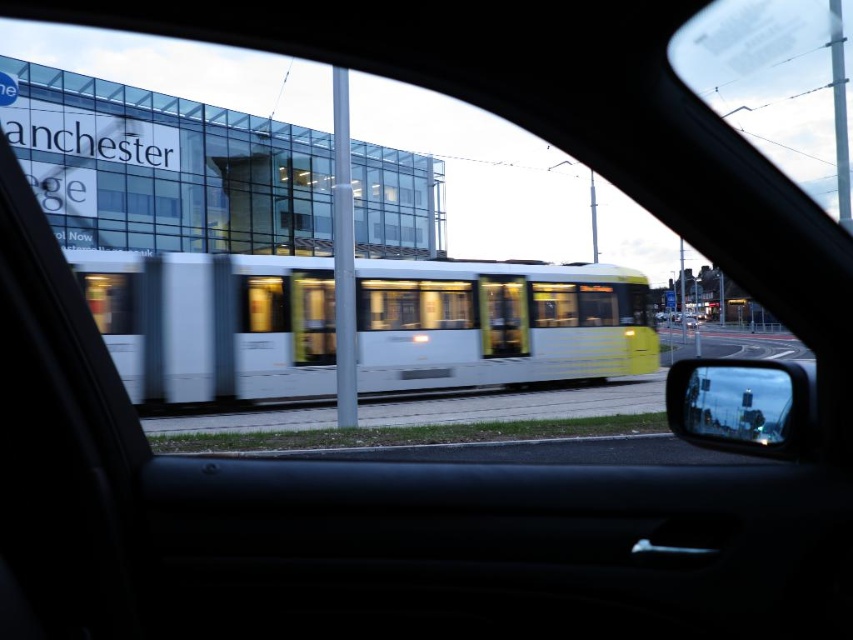
Question: Does white glossy train at center appear on the right side of reflective glass mirror at right?

Choices:
 (A) yes
 (B) no

Answer: (B)

Question: Does white glossy train at center lie behind reflective glass mirror at right?

Choices:
 (A) yes
 (B) no

Answer: (A)

Question: Can you confirm if white glossy train at center is bigger than reflective glass mirror at right?

Choices:
 (A) no
 (B) yes

Answer: (A)

Question: Which point is closer to the camera?

Choices:
 (A) white glossy train at center
 (B) reflective glass mirror at right

Answer: (B)